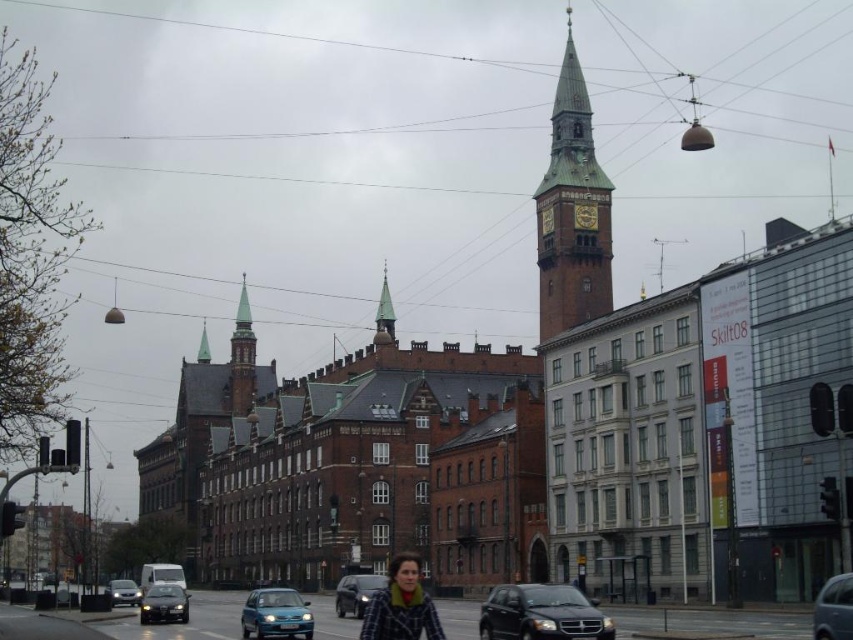
Question: Which object is closer to the camera taking this photo?

Choices:
 (A) metallic silver car at lower right
 (B) shiny black sedan at center
 (C) goldmetallicclock at center
 (D) gold metallic clock at center

Answer: (A)

Question: Is green copper clock tower at upper center positioned at the back of green copper spire at center?

Choices:
 (A) no
 (B) yes

Answer: (A)

Question: Which object appears closest to the camera in this image?

Choices:
 (A) goldmetallicclock at center
 (B) metallic silver car at lower right

Answer: (B)

Question: Does green copper clock tower at upper center have a larger size compared to plaid wool coat at center?

Choices:
 (A) yes
 (B) no

Answer: (A)

Question: Can you confirm if greenish-brown stone spire at center-left is positioned to the right of gold metallic clock at center?

Choices:
 (A) no
 (B) yes

Answer: (A)

Question: Which object is the closest to the metallic blue car at center?

Choices:
 (A) shiny black sedan at lower left
 (B) green copper spire at center
 (C) metallic silver car at lower right
 (D) gold metallic clock at center

Answer: (A)